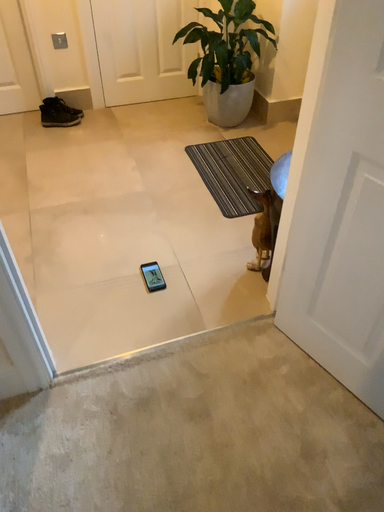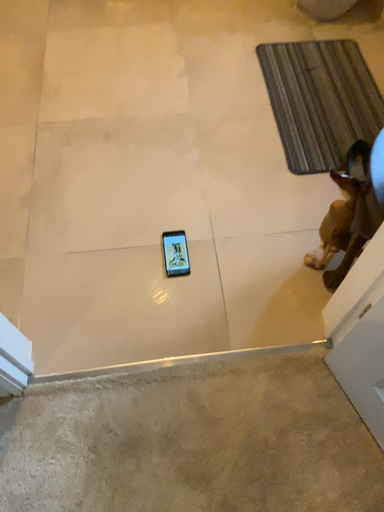
Question: How did the camera likely rotate when shooting the video?

Choices:
 (A) rotated left
 (B) rotated right

Answer: (A)